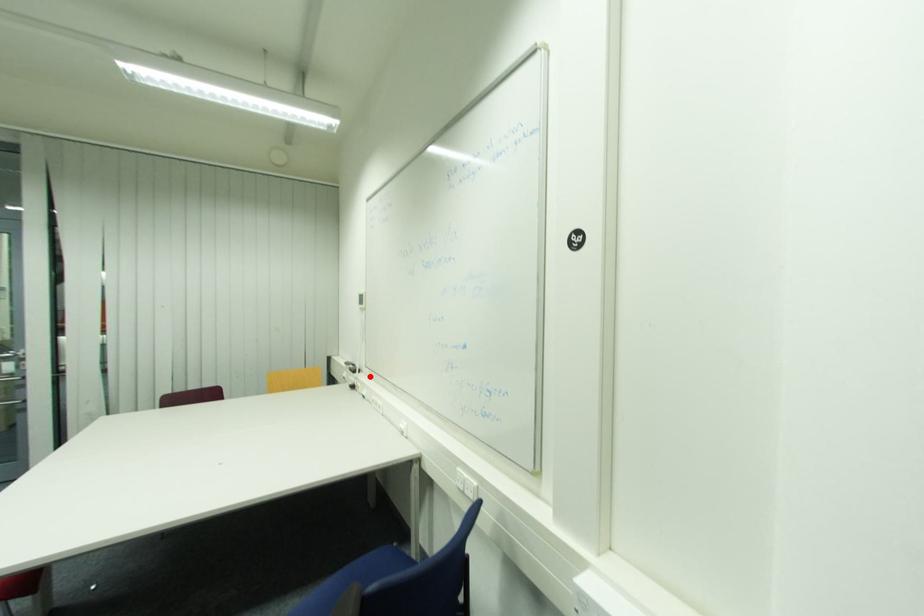
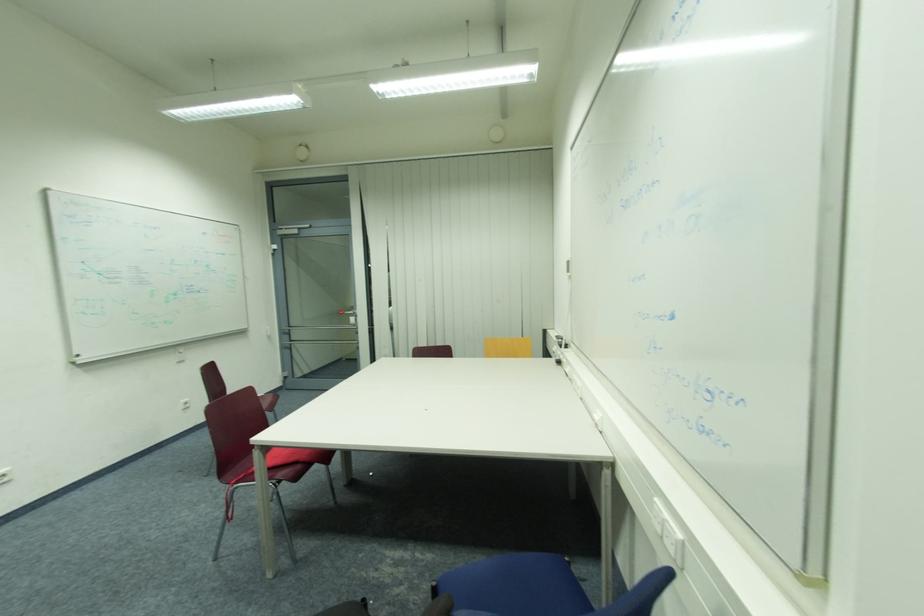
Question: I am providing you with two images of the same scene from different viewpoints. A red point is shown in image1. For the corresponding object point in image2, is it positioned nearer or farther from the camera?

Choices:
 (A) Nearer
 (B) Farther

Answer: (A)